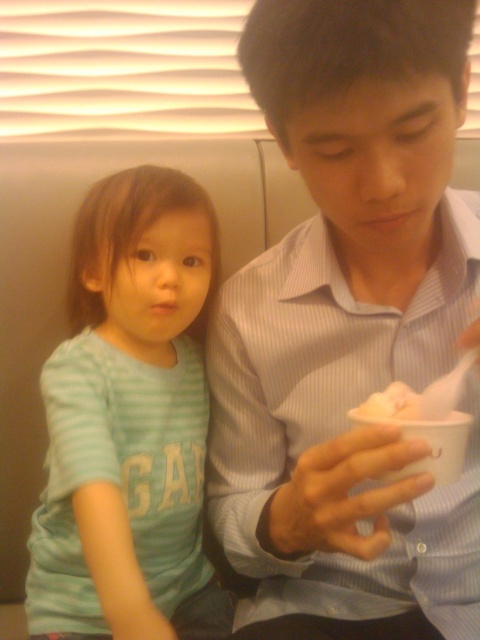
Question: Which object is positioned farthest from the light blue striped shirt at left?

Choices:
 (A) white paper food at center
 (B) matte blue shirt at center

Answer: (A)

Question: Is light blue striped shirt at left wider than white paper food at center?

Choices:
 (A) yes
 (B) no

Answer: (A)

Question: Can you confirm if matte blue shirt at center is thinner than light blue striped shirt at left?

Choices:
 (A) yes
 (B) no

Answer: (A)

Question: Does matte blue shirt at center have a lesser width compared to light blue striped shirt at left?

Choices:
 (A) yes
 (B) no

Answer: (A)

Question: Among these points, which one is farthest from the camera?

Choices:
 (A) [399, 401]
 (B) [98, 333]

Answer: (B)

Question: Which point is farther from the camera taking this photo?

Choices:
 (A) (408, 406)
 (B) (110, 509)

Answer: (B)